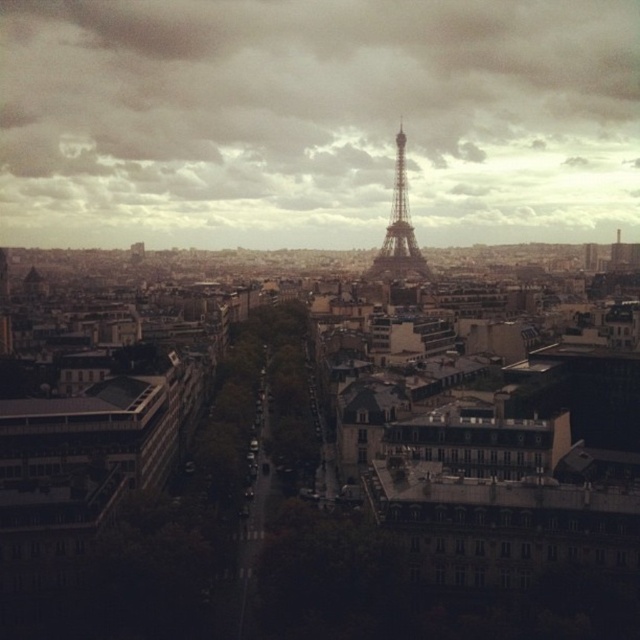
Question: Which object is closer to the camera taking this photo?

Choices:
 (A) cloudy sky at center
 (B) shiny metallic tower at center

Answer: (B)

Question: Does cloudy sky at center appear on the right side of shiny metallic tower at center?

Choices:
 (A) no
 (B) yes

Answer: (A)

Question: Is cloudy sky at center behind shiny metallic tower at center?

Choices:
 (A) yes
 (B) no

Answer: (A)

Question: Considering the relative positions of cloudy sky at center and shiny metallic tower at center in the image provided, where is cloudy sky at center located with respect to shiny metallic tower at center?

Choices:
 (A) below
 (B) above

Answer: (B)